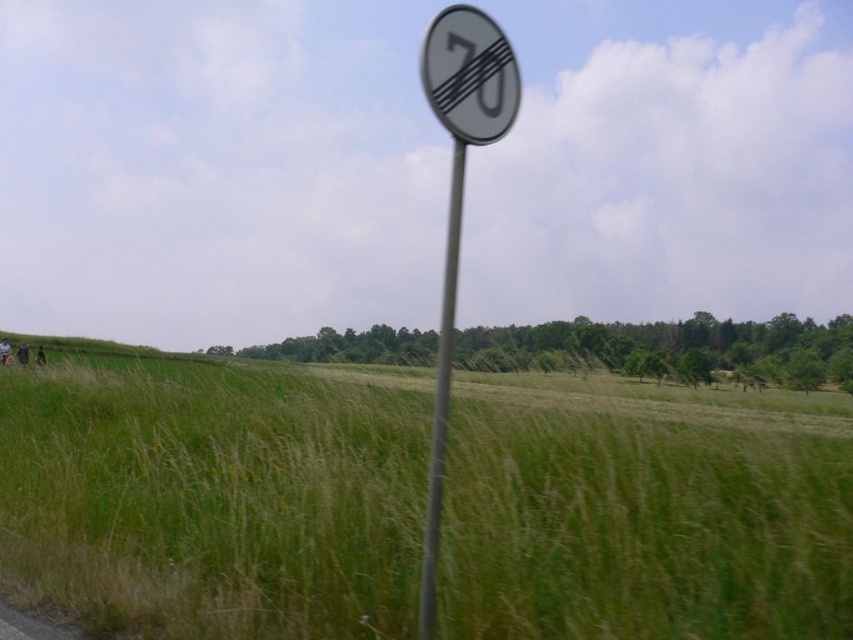
You are a delivery driver who needs to attach a GPS tracker to the white plastic speed limit sign at upper center. The GPS tracker is 100 centimeters long. Can you attach it from the metallic pole at center to the sign without needing to extend it further?

The distance between the white plastic speed limit sign at upper center and the metallic pole at center is 99.52 centimeters. Since the GPS tracker is 100 centimeters long, it is just barely long enough to reach between them without needing to extend it further.

From the picture: You are a driver approaching the rural landscape scene and need to know the current speed limit. According to the sign at point (457, 202), what is the current speed limit?

The current speed limit is 70 kmph, as indicated by the white plastic speed limit sign at center, which shows the number 70 crossed out by a diagonal line, meaning the previous limit was 70 and it has been reduced.

You are driving a car and see the white plastic speed limit sign at upper center and the metallic pole at center ahead on the road. Which object will you encounter first as you drive forward?

The white plastic speed limit sign at upper center will be encountered first because it is closer to the viewer than the metallic pole at center.